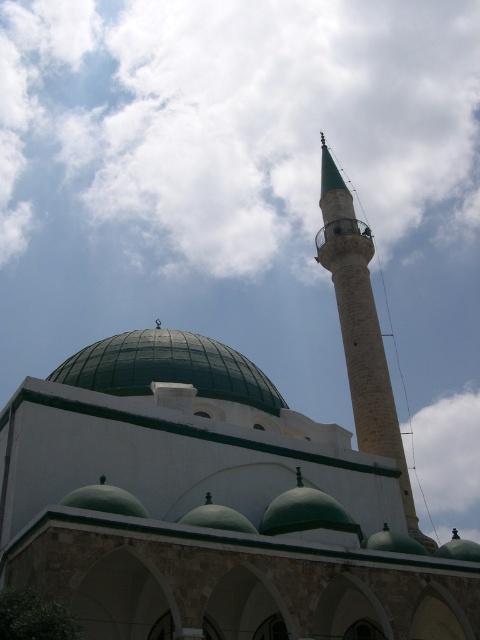
Between point (396, 419) and point (189, 353), which one is positioned in front?

Point (189, 353) is more forward.

Looking at this image, can you confirm if green stone minaret at upper right is wider than green matte dome at center?

Incorrect, green stone minaret at upper right's width does not surpass green matte dome at center's.

Describe the element at coordinates (360, 330) in the screenshot. The image size is (480, 640). I see `green stone minaret at upper right` at that location.

Identify the location of green stone minaret at upper right. (360, 330).

Is cloudy sky at upper center taller than green stone minaret at upper right?

Correct, cloudy sky at upper center is much taller as green stone minaret at upper right.

This screenshot has width=480, height=640. What are the coordinates of `cloudy sky at upper center` in the screenshot? It's located at (241, 116).

Does cloudy sky at upper center lie in front of green matte dome at center?

No, cloudy sky at upper center is behind green matte dome at center.

Where is `cloudy sky at upper center`? This screenshot has height=640, width=480. cloudy sky at upper center is located at coordinates (241, 116).

Locate an element on the screen. The height and width of the screenshot is (640, 480). cloudy sky at upper center is located at coordinates (241, 116).